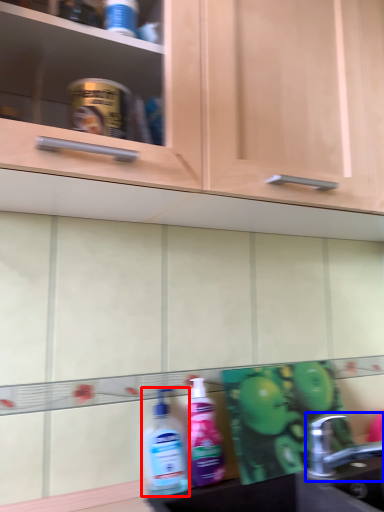
Question: Which object appears closest to the camera in this image, cleaning product (highlighted by a red box) or tap (highlighted by a blue box)?

Choices:
 (A) cleaning product
 (B) tap

Answer: (B)